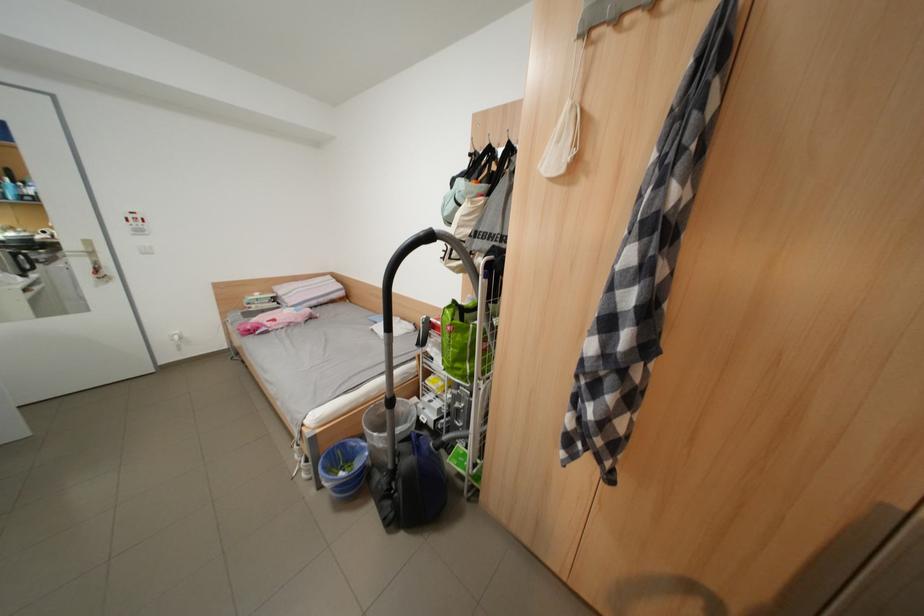
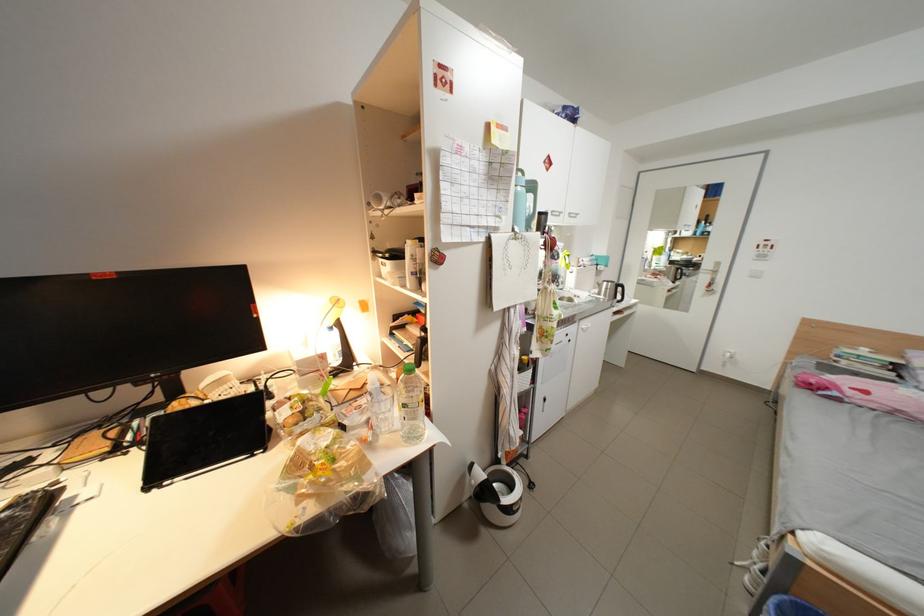
Question: I am providing you with two images of the same scene from different viewpoints. After the viewpoint changes to image2, which objects are now occluded?

Choices:
 (A) white light switch
 (B) yellow desk lamp
 (C) blue water bottle
 (D) none of these

Answer: (D)